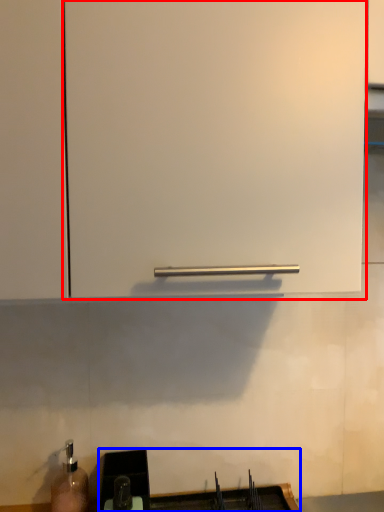
Question: Which object is closer to the camera taking this photo, cabinetry (highlighted by a red box) or sink (highlighted by a blue box)?

Choices:
 (A) cabinetry
 (B) sink

Answer: (A)